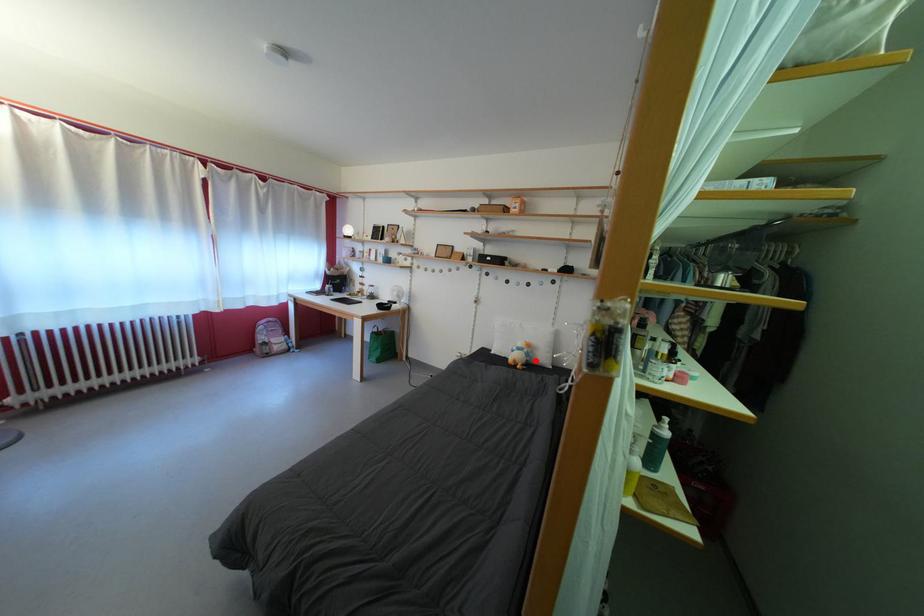
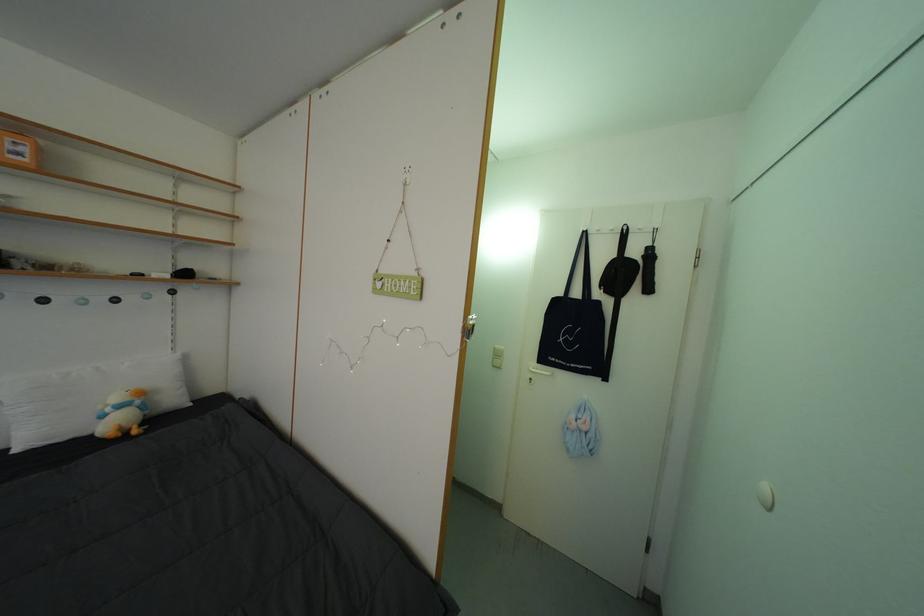
Where in the second image is the point corresponding to the highlighted location from the first image?

(152, 413)